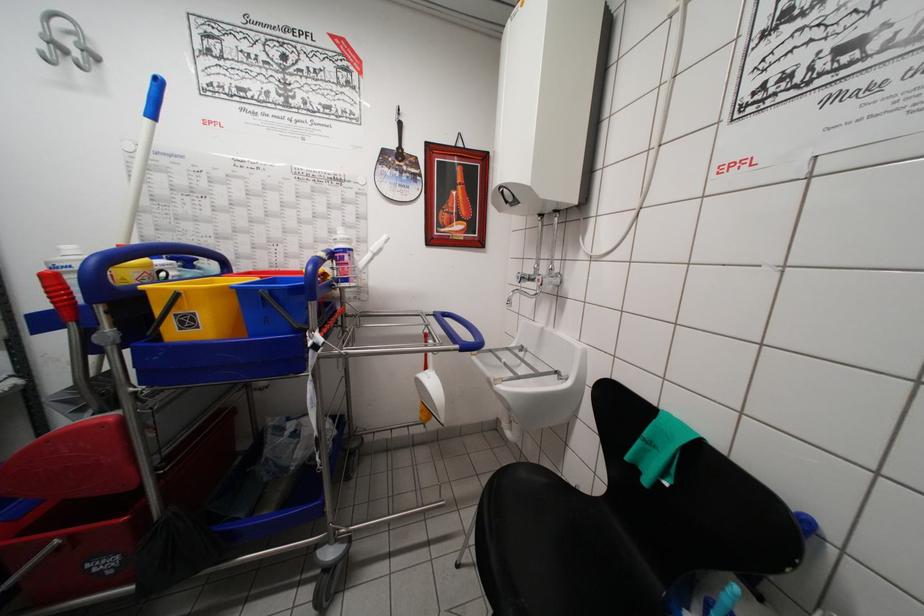
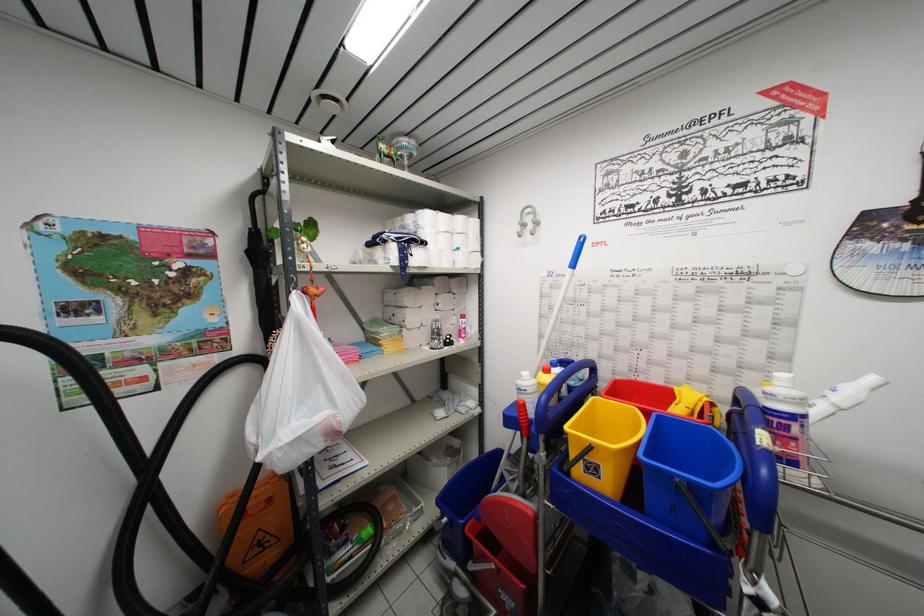
Find the pixel in the second image that matches point 260,294 in the first image.

(675, 479)